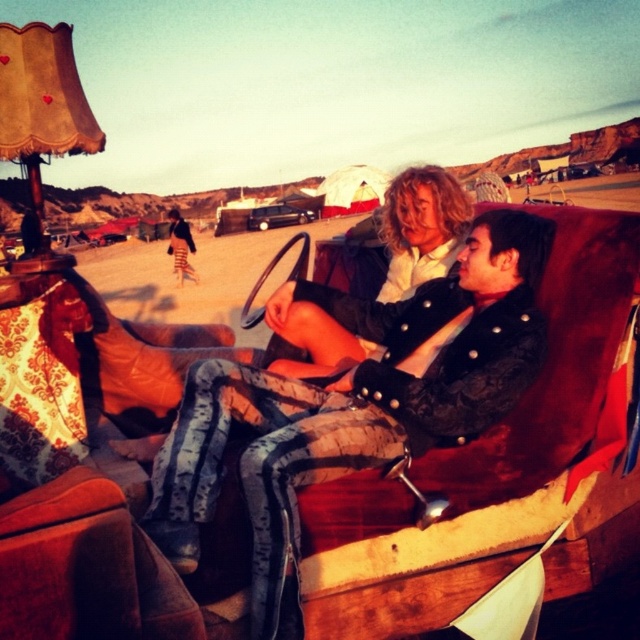
What do you see at coordinates (353, 403) in the screenshot? I see `black leather jacket at center` at bounding box center [353, 403].

Which is behind, point (483, 301) or point (401, 173)?

The point (401, 173) is behind.

Find the location of a particular element. Image resolution: width=640 pixels, height=640 pixels. black leather jacket at center is located at coordinates (353, 403).